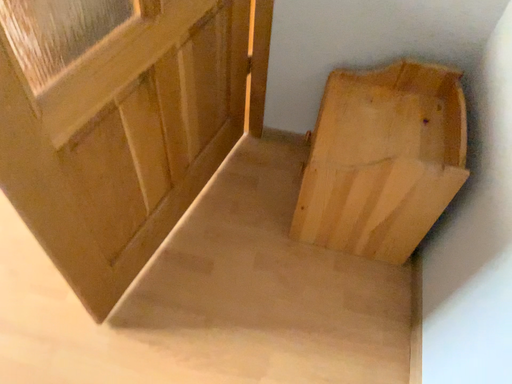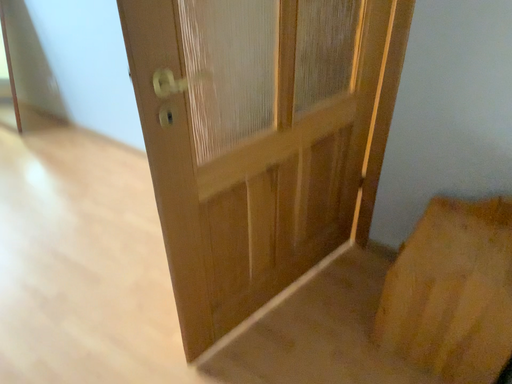
Question: How did the camera likely rotate when shooting the video?

Choices:
 (A) rotated upward
 (B) rotated downward

Answer: (A)